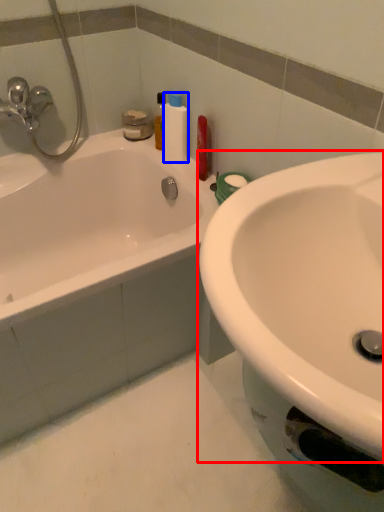
Question: Which object is further to the camera taking this photo, sink (highlighted by a red box) or cleaning product (highlighted by a blue box)?

Choices:
 (A) sink
 (B) cleaning product

Answer: (B)